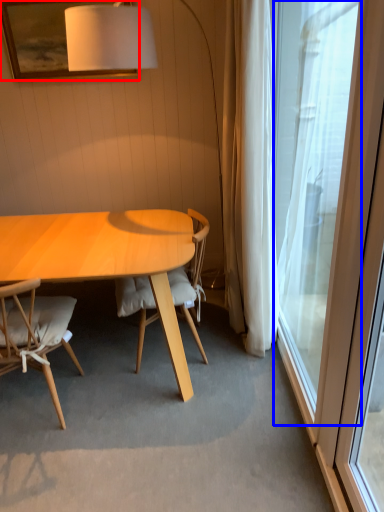
Question: Which object appears closest to the camera in this image, picture frame (highlighted by a red box) or window (highlighted by a blue box)?

Choices:
 (A) picture frame
 (B) window

Answer: (B)